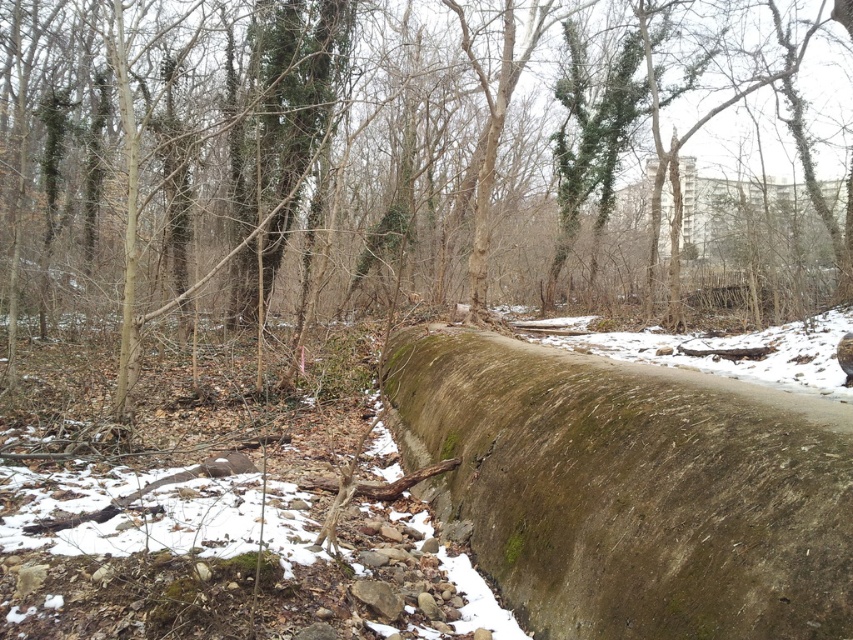
Who is positioned more to the left, green mossy wall at center or green mossy concrete log at center?

green mossy concrete log at center

Does green mossy wall at center have a smaller size compared to green mossy concrete log at center?

No, green mossy wall at center is not smaller than green mossy concrete log at center.

Who is more distant from viewer, (202, 172) or (527, 372)?

The point (202, 172) is behind.

Locate an element on the screen. green mossy wall at center is located at coordinates (387, 168).